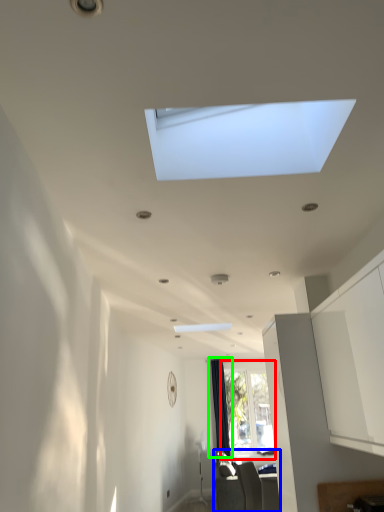
Question: Which object is positioned closest to window (highlighted by a red box)? Select from furniture (highlighted by a blue box) and curtain (highlighted by a green box).

Choices:
 (A) furniture
 (B) curtain

Answer: (B)